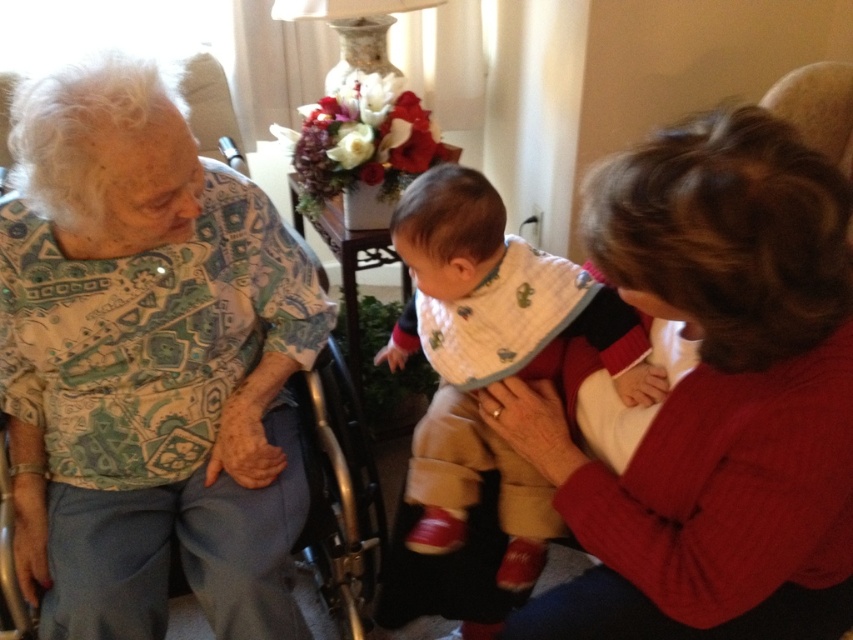
You are a photographer trying to capture a closeup of the white cotton bib at center without the printed fabric shirt at left blocking it. What should you do?

Move the camera to the right so that the white cotton bib at center is no longer behind the printed fabric shirt at left.

You are a photographer setting up a shoot in this scene. You need to ensure that the matte red sweater at center and the white cotton bib at center are both visible in the frame. Given their sizes, which item should you focus on to ensure both are captured without cropping?

The matte red sweater at center is larger in width than the white cotton bib at center. To ensure both are visible without cropping, focus on framing the larger item, the matte red sweater at center, as it requires more space.